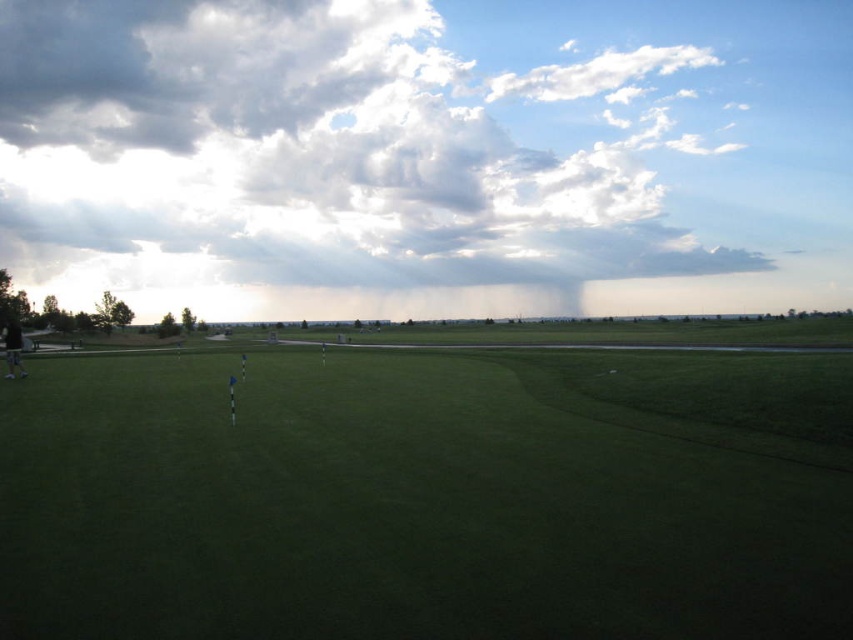
Question: Is green grassy field at center smaller than cloudy sky at upper center?

Choices:
 (A) no
 (B) yes

Answer: (B)

Question: Which object appears farthest from the camera in this image?

Choices:
 (A) green grassy field at center
 (B) cloudy sky at upper center

Answer: (B)

Question: Which of the following is the farthest from the observer?

Choices:
 (A) (242, 42)
 (B) (149, 499)

Answer: (A)

Question: Does green grassy field at center lie behind cloudy sky at upper center?

Choices:
 (A) yes
 (B) no

Answer: (B)

Question: Can you confirm if green grassy field at center is wider than cloudy sky at upper center?

Choices:
 (A) no
 (B) yes

Answer: (A)